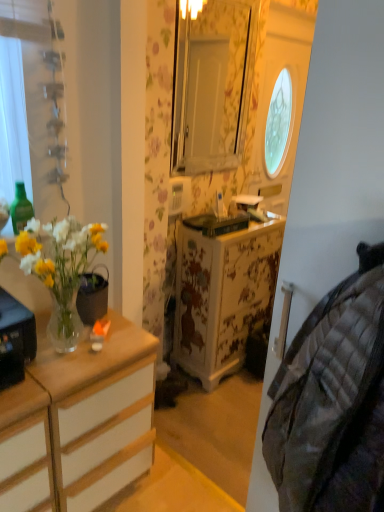
Image resolution: width=384 pixels, height=512 pixels. Identify the location of plaid fabric quilt at right. (333, 401).

What is the approximate height of wooden cabinet at left, positioned as the second cabinetry in right-to-left order?

It is 28.03 inches.

The width and height of the screenshot is (384, 512). Find the location of `wooden cabinet at left, positioned as the second cabinetry in right-to-left order`. wooden cabinet at left, positioned as the second cabinetry in right-to-left order is located at coordinates (25, 449).

The height and width of the screenshot is (512, 384). Identify the location of clear glass vase at left. (x=15, y=339).

Describe the element at coordinates (15, 339) in the screenshot. I see `clear glass vase at left` at that location.

At what (x,y) coordinates should I click in order to perform the action: click on green glass bottle at left. Please return your answer as a coordinate pair (x, y). Looking at the image, I should click on click(x=20, y=208).

Does point (22, 187) come closer to viewer compared to point (280, 404)?

No, it is behind (280, 404).

Is green glass bottle at left not near plaid fabric quilt at right?

green glass bottle at left is far away from plaid fabric quilt at right.

Considering the relative positions of green glass bottle at left and plaid fabric quilt at right in the image provided, is green glass bottle at left to the right of plaid fabric quilt at right from the viewer's perspective?

In fact, green glass bottle at left is to the left of plaid fabric quilt at right.

From a real-world perspective, is green glass bottle at left located higher than plaid fabric quilt at right?

Yes, from a real-world perspective, green glass bottle at left is above plaid fabric quilt at right.

From the picture: Looking at their sizes, would you say white wood dresser at left, which is counted as the second cabinetry, starting from the left, is wider or thinner than wooden cabinet at left, positioned as the second cabinetry in right-to-left order?

In the image, white wood dresser at left, which is counted as the second cabinetry, starting from the left, appears to be wider than wooden cabinet at left, positioned as the second cabinetry in right-to-left order.

Between white wood dresser at left, which is counted as the second cabinetry, starting from the left, and wooden cabinet at left, which is the first cabinetry from left to right, which one has smaller size?

wooden cabinet at left, which is the first cabinetry from left to right.

Which object is more forward, white wood dresser at left, which is counted as the second cabinetry, starting from the left, or wooden cabinet at left, positioned as the second cabinetry in right-to-left order?

wooden cabinet at left, positioned as the second cabinetry in right-to-left order, is closer to the camera.

Would you consider white wood dresser at left, the first cabinetry viewed from the right, to be distant from wooden cabinet at left, which is the first cabinetry from left to right?

white wood dresser at left, the first cabinetry viewed from the right, is near wooden cabinet at left, which is the first cabinetry from left to right, not far away.

From the picture: From the image's perspective, is green glass bottle at left above white wood dresser at left, which is counted as the second cabinetry, starting from the left?

Yes.

Is white wood dresser at left, the first cabinetry viewed from the right, a part of green glass bottle at left?

No, white wood dresser at left, the first cabinetry viewed from the right, is located outside of green glass bottle at left.

Which is in front, point (31, 205) or point (23, 508)?

Positioned in front is point (23, 508).

From a real-world perspective, which is physically below, plaid fabric quilt at right or green glass bottle at left?

In real-world perspective, plaid fabric quilt at right is lower.

The height and width of the screenshot is (512, 384). Identify the location of material below the green glass bottle at left (from the image's perspective). (333, 401).

Who is smaller, plaid fabric quilt at right or green glass bottle at left?

green glass bottle at left.

From the image's perspective, is clear glass vase at left under white wood dresser at left, the first cabinetry viewed from the right?

No, from the image's perspective, clear glass vase at left is not beneath white wood dresser at left, the first cabinetry viewed from the right.

Considering the positions of point (5, 348) and point (71, 441), is point (5, 348) closer or farther from the camera than point (71, 441)?

Clearly, point (5, 348) is closer to the camera than point (71, 441).

Considering the sizes of objects clear glass vase at left and white wood dresser at left, the first cabinetry viewed from the right, in the image provided, who is thinner, clear glass vase at left or white wood dresser at left, the first cabinetry viewed from the right,?

clear glass vase at left.

Consider the image. Which is more to the right, clear glass vase at left or white wood dresser at left, the first cabinetry viewed from the right?

white wood dresser at left, the first cabinetry viewed from the right, is more to the right.

Is plaid fabric quilt at right aimed at white wood dresser at left, which is counted as the second cabinetry, starting from the left?

No, plaid fabric quilt at right does not turn towards white wood dresser at left, which is counted as the second cabinetry, starting from the left.

From the image's perspective, is plaid fabric quilt at right beneath white wood dresser at left, which is counted as the second cabinetry, starting from the left?

No.

Considering the relative positions of plaid fabric quilt at right and white wood dresser at left, which is counted as the second cabinetry, starting from the left, in the image provided, is plaid fabric quilt at right behind white wood dresser at left, which is counted as the second cabinetry, starting from the left,?

That is False.

Identify the location of cabinetry that is the 1st one below the plaid fabric quilt at right (from a real-world perspective). Image resolution: width=384 pixels, height=512 pixels. (80, 421).

Is clear glass vase at left taller than green glass bottle at left?

Yes.

Is clear glass vase at left positioned before green glass bottle at left?

Yes, it is in front of green glass bottle at left.

How many degrees apart are the facing directions of clear glass vase at left and green glass bottle at left?

The angle between the facing direction of clear glass vase at left and the facing direction of green glass bottle at left is 0.298 degrees.

Is clear glass vase at left not within green glass bottle at left?

Absolutely, clear glass vase at left is external to green glass bottle at left.

The height and width of the screenshot is (512, 384). Find the location of `bottle above the plaid fabric quilt at right (from the image's perspective)`. bottle above the plaid fabric quilt at right (from the image's perspective) is located at coordinates (20, 208).

The height and width of the screenshot is (512, 384). I want to click on cabinetry below the white wood dresser at left, which is counted as the second cabinetry, starting from the left (from the image's perspective), so click(x=25, y=449).

From the image, which object appears to be nearer to green glass bottle at left, wooden cabinet at left, which is the first cabinetry from left to right, or plaid fabric quilt at right?

wooden cabinet at left, which is the first cabinetry from left to right.

Based on their spatial positions, is plaid fabric quilt at right or green glass bottle at left further from white wood dresser at left, the first cabinetry viewed from the right?

plaid fabric quilt at right.

Looking at the image, which one is located further to plaid fabric quilt at right, wooden cabinet at left, which is the first cabinetry from left to right, or clear glass vase at left?

clear glass vase at left is positioned further to the anchor plaid fabric quilt at right.

In the scene shown: Based on their spatial positions, is wooden cabinet at left, which is the first cabinetry from left to right, or white wood dresser at left, which is counted as the second cabinetry, starting from the left, closer to clear glass vase at left?

wooden cabinet at left, which is the first cabinetry from left to right, is closer to clear glass vase at left.

Considering their positions, is wooden cabinet at left, positioned as the second cabinetry in right-to-left order, positioned closer to white wood dresser at left, which is counted as the second cabinetry, starting from the left, than clear glass vase at left?

wooden cabinet at left, positioned as the second cabinetry in right-to-left order, lies closer to white wood dresser at left, which is counted as the second cabinetry, starting from the left, than the other object.

Considering their positions, is clear glass vase at left positioned closer to white wood dresser at left, which is counted as the second cabinetry, starting from the left, than green glass bottle at left?

clear glass vase at left.

Considering their positions, is clear glass vase at left positioned closer to plaid fabric quilt at right than wooden cabinet at left, which is the first cabinetry from left to right?

wooden cabinet at left, which is the first cabinetry from left to right, is closer to plaid fabric quilt at right.

Which object lies further to the anchor point green glass bottle at left, plaid fabric quilt at right or clear glass vase at left?

plaid fabric quilt at right is further to green glass bottle at left.

Find the location of a particular element. desk between green glass bottle at left and white wood dresser at left, which is counted as the second cabinetry, starting from the left, in the up-down direction is located at coordinates (15, 339).

Locate an element on the screen. The height and width of the screenshot is (512, 384). desk between wooden cabinet at left, positioned as the second cabinetry in right-to-left order, and plaid fabric quilt at right from left to right is located at coordinates (15, 339).

Where is `bottle located between clear glass vase at left and plaid fabric quilt at right in the left-right direction`? The height and width of the screenshot is (512, 384). bottle located between clear glass vase at left and plaid fabric quilt at right in the left-right direction is located at coordinates (20, 208).

Locate an element on the screen. bottle situated between wooden cabinet at left, which is the first cabinetry from left to right, and plaid fabric quilt at right from left to right is located at coordinates [20, 208].